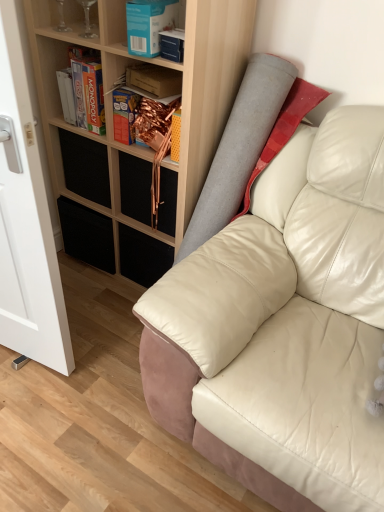
Locate an element on the screen. This screenshot has height=512, width=384. vacant area that lies in front of white glossy glass door at left is located at coordinates (32, 409).